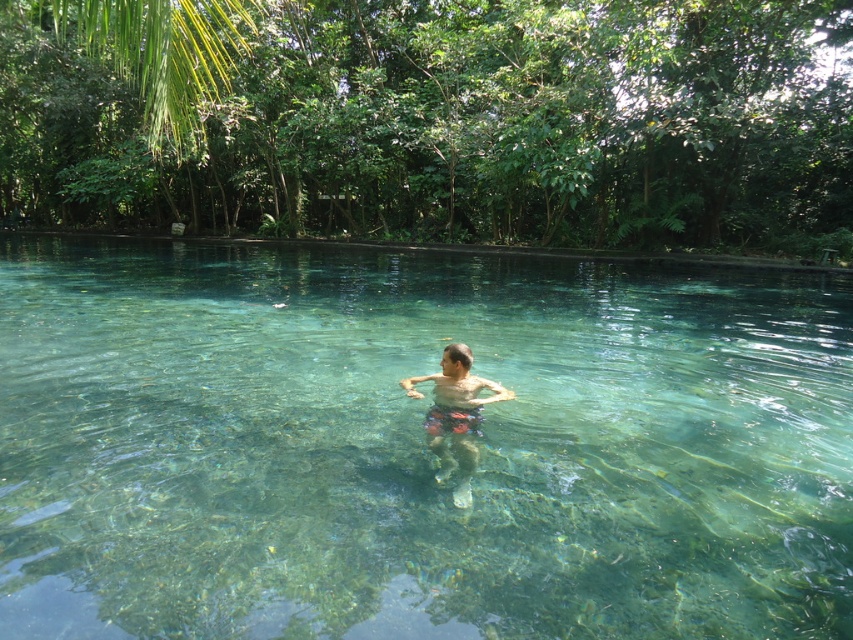
You are a lifeguard observing the clear glass pool at center and the multicolored swim trunks at center. Which object is located above the other?

The clear glass pool at center is positioned over multicolored swim trunks at center, meaning the pool is above the swim trunks.

You are a lifeguard observing the clear glass pool at center and the multicolored swim trunks at center. Which object is taller?

The clear glass pool at center is much taller than the multicolored swim trunks at center.

You are standing at the edge of the clear glass pool at center and want to reach the multicolored swim trunks at center. Which direction should you move to get there?

The clear glass pool at center is to the right of the multicolored swim trunks at center, so you should move to your left to reach them.